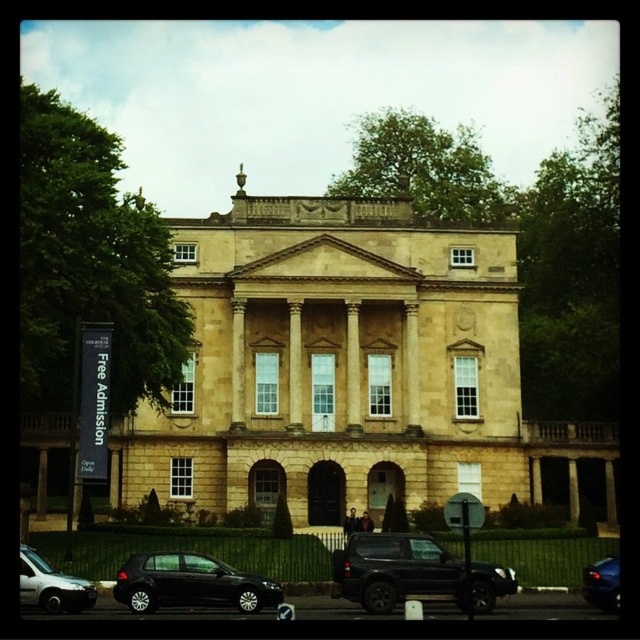
Which is above, shiny black car at lower left or silver metallic hatchback at lower left?

shiny black car at lower left is above.

Is point (216, 560) in front of point (68, 579)?

No, (216, 560) is behind (68, 579).

The image size is (640, 640). Describe the element at coordinates (189, 582) in the screenshot. I see `shiny black car at lower left` at that location.

Locate an element on the screen. Image resolution: width=640 pixels, height=640 pixels. shiny black car at lower left is located at coordinates (189, 582).

Which is below, silver metallic hatchback at lower left or shiny blue sedan at lower right?

silver metallic hatchback at lower left is lower down.

Who is positioned more to the left, silver metallic hatchback at lower left or shiny blue sedan at lower right?

From the viewer's perspective, silver metallic hatchback at lower left appears more on the left side.

The width and height of the screenshot is (640, 640). Find the location of `silver metallic hatchback at lower left`. silver metallic hatchback at lower left is located at coordinates (51, 586).

Where is `silver metallic hatchback at lower left`? Image resolution: width=640 pixels, height=640 pixels. silver metallic hatchback at lower left is located at coordinates (51, 586).

Between black matte suv at center and shiny black car at lower left, which one appears on the right side from the viewer's perspective?

black matte suv at center is more to the right.

Can you confirm if black matte suv at center is wider than shiny black car at lower left?

No.

Who is more distant from viewer, (468, 582) or (148, 595)?

Point (148, 595)

Locate an element on the screen. The image size is (640, 640). black matte suv at center is located at coordinates (396, 570).